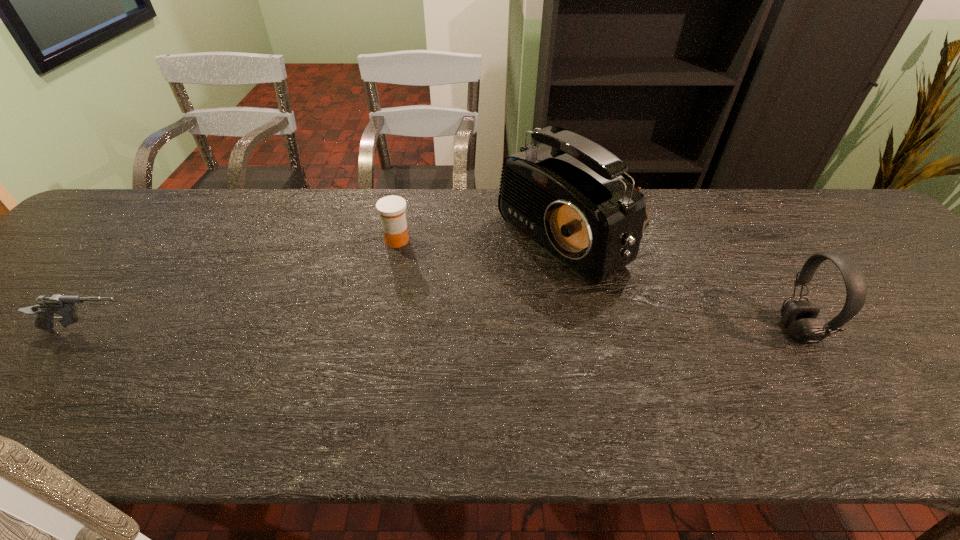
Identify the location of free space on the desktop that is between the gun and the second tallest object and is positioned on the front-facing side of the second object from right to left. (410, 331).

In order to click on free spot on the desktop that is between the leftmost object and the third shortest object and is positioned on the label of the medicine in this screenshot , I will do `click(379, 331)`.